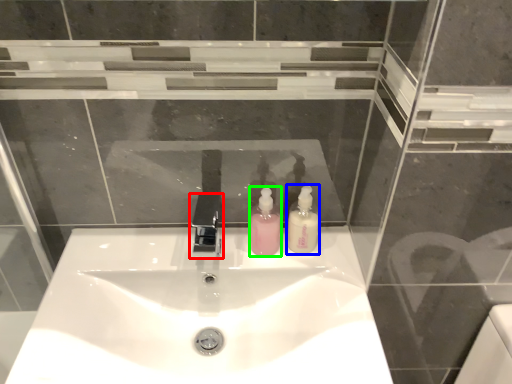
Question: Considering the real-world distances, which object is closest to tap (highlighted by a red box)? soap dispenser (highlighted by a blue box) or soap dispenser (highlighted by a green box).

Choices:
 (A) soap dispenser
 (B) soap dispenser

Answer: (B)